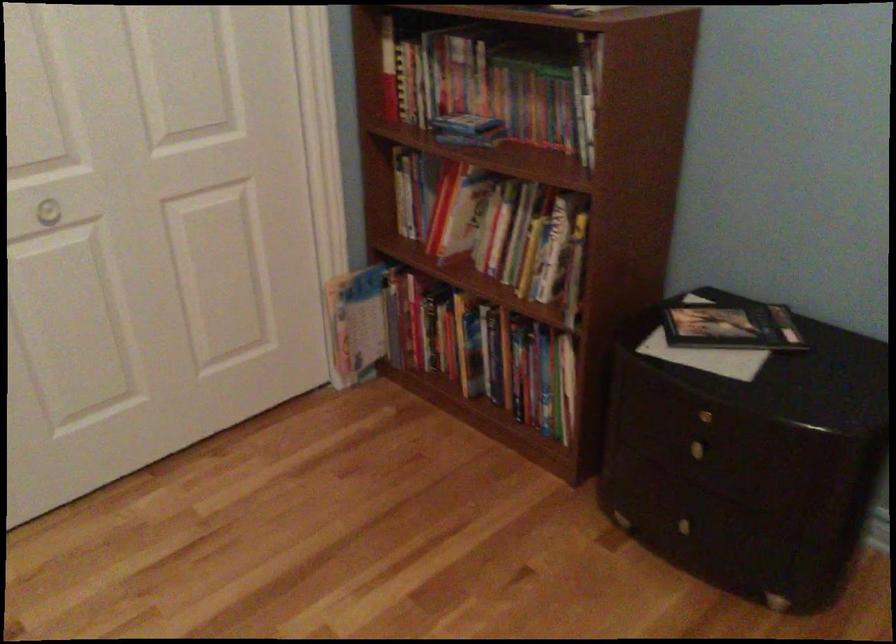
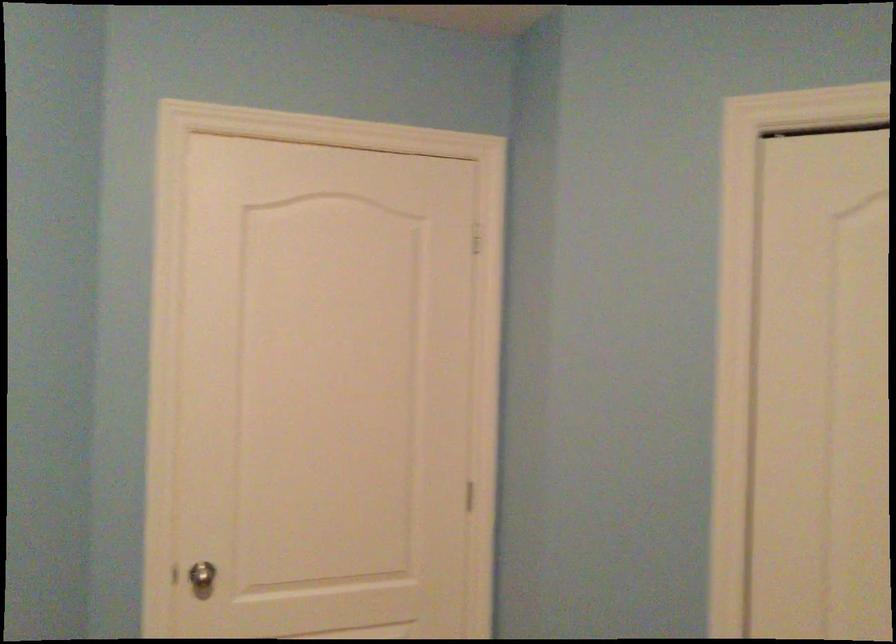
Question: Based on the continuous images, in which direction is the camera rotating? Reply with the corresponding letter.

Choices:
 (A) Left
 (B) Right
 (C) Up
 (D) Down

Answer: (A)